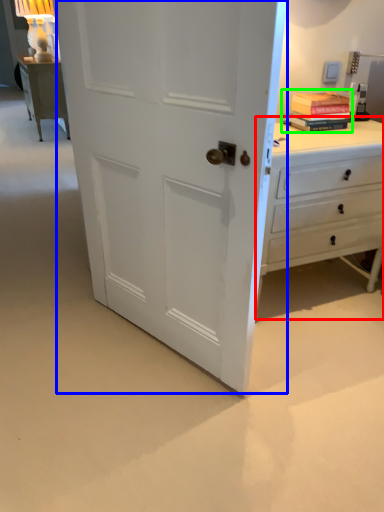
Question: Which is nearer to the chest of drawers (highlighted by a red box)? door (highlighted by a blue box) or book (highlighted by a green box).

Choices:
 (A) door
 (B) book

Answer: (B)